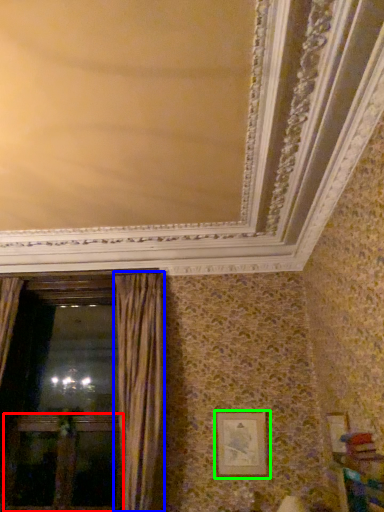
Question: Which object is the farthest from screen door (highlighted by a red box)? Choose among these: curtain (highlighted by a blue box) or picture frame (highlighted by a green box).

Choices:
 (A) curtain
 (B) picture frame

Answer: (B)